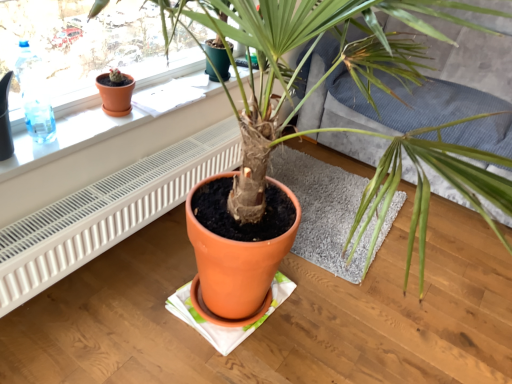
Question: Is textured gray couch at center further to the viewer compared to terracotta pot at upper left?

Choices:
 (A) no
 (B) yes

Answer: (B)

Question: Is the position of textured gray couch at center less distant than that of terracotta pot at upper left?

Choices:
 (A) no
 (B) yes

Answer: (A)

Question: From a real-world perspective, is textured gray couch at center below terracotta pot at upper left?

Choices:
 (A) no
 (B) yes

Answer: (A)

Question: From the image's perspective, would you say textured gray couch at center is positioned over terracotta pot at upper left?

Choices:
 (A) no
 (B) yes

Answer: (B)

Question: From the image's perspective, is textured gray couch at center under terracotta pot at upper left?

Choices:
 (A) no
 (B) yes

Answer: (A)

Question: Considering the positions of terracotta pot at center and textured gray couch at center in the image, is terracotta pot at center taller or shorter than textured gray couch at center?

Choices:
 (A) tall
 (B) short

Answer: (A)

Question: Does point (370, 57) appear closer or farther from the camera than point (509, 39)?

Choices:
 (A) farther
 (B) closer

Answer: (B)

Question: In the image, is terracotta pot at center positioned in front of or behind textured gray couch at center?

Choices:
 (A) behind
 (B) front

Answer: (B)

Question: From the image's perspective, relative to textured gray couch at center, is terracotta pot at center above or below?

Choices:
 (A) below
 (B) above

Answer: (A)

Question: From the image's perspective, relative to terracotta pot at upper left, is transparent plastic bottle at upper left above or below?

Choices:
 (A) above
 (B) below

Answer: (B)

Question: In terms of width, does transparent plastic bottle at upper left look wider or thinner when compared to terracotta pot at upper left?

Choices:
 (A) thin
 (B) wide

Answer: (A)

Question: Considering the positions of transparent plastic bottle at upper left and terracotta pot at upper left in the image, is transparent plastic bottle at upper left taller or shorter than terracotta pot at upper left?

Choices:
 (A) tall
 (B) short

Answer: (A)

Question: Would you say transparent plastic bottle at upper left is inside or outside terracotta pot at upper left?

Choices:
 (A) inside
 (B) outside

Answer: (B)

Question: Does point (507, 175) appear closer or farther from the camera than point (309, 173)?

Choices:
 (A) closer
 (B) farther

Answer: (B)

Question: Is textured gray couch at center in front of or behind terracotta pot at center in the image?

Choices:
 (A) front
 (B) behind

Answer: (A)